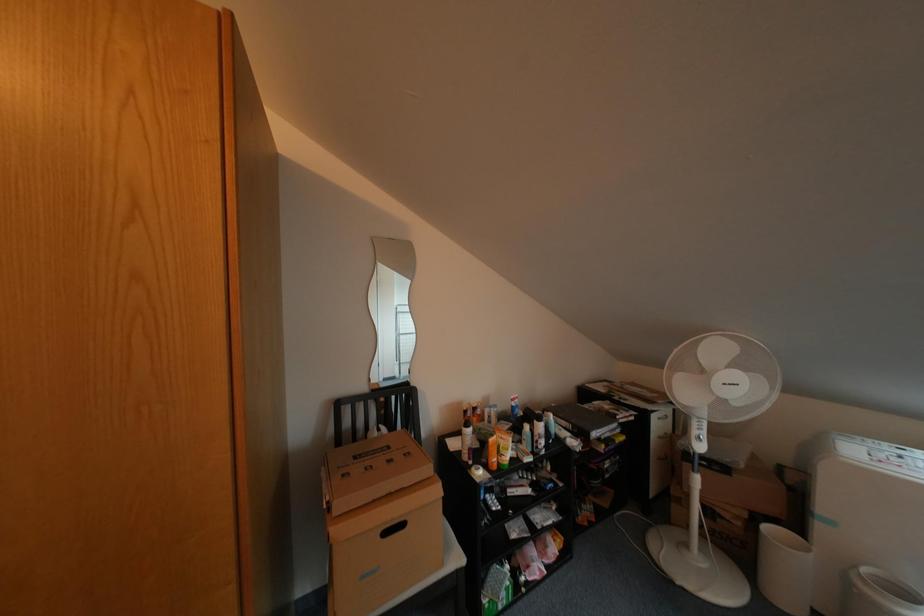
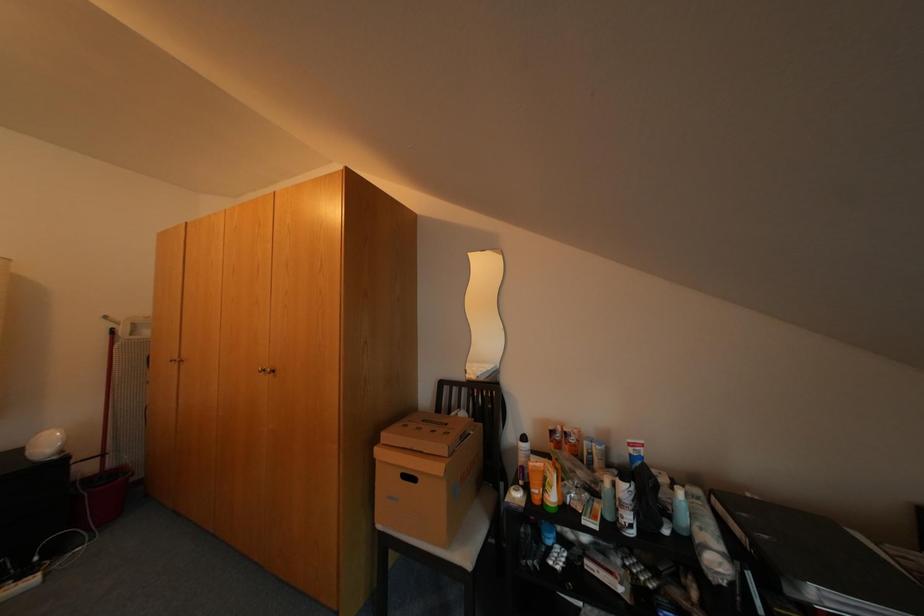
Question: The first image is from the beginning of the video and the second image is from the end. How did the camera likely rotate when shooting the video?

Choices:
 (A) Left
 (B) Right
 (C) Up
 (D) Down

Answer: (A)